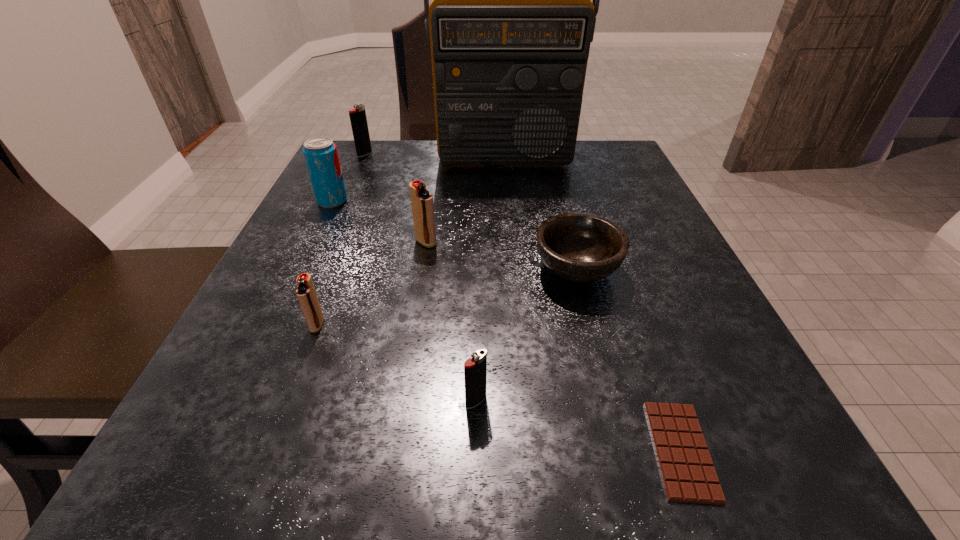
Identify the location of bowl. The height and width of the screenshot is (540, 960). click(580, 247).

Where is `brown bowl`? brown bowl is located at coordinates (580, 247).

Where is `the shortest object`? Image resolution: width=960 pixels, height=540 pixels. the shortest object is located at coordinates (688, 474).

I want to click on brown candy bar, so click(688, 474).

Find the location of `vacant area situated 0.050m on the front-facing side of the radio receiver`. vacant area situated 0.050m on the front-facing side of the radio receiver is located at coordinates (507, 183).

This screenshot has height=540, width=960. I want to click on vacant space located on the front of the third farthest object, so click(306, 255).

Where is `free space located on the right of the left black igniter`? The image size is (960, 540). free space located on the right of the left black igniter is located at coordinates (513, 154).

The width and height of the screenshot is (960, 540). I want to click on vacant space situated on the left of the bigger red igniter, so click(x=304, y=242).

Locate an element on the screen. This screenshot has height=540, width=960. vacant space located on the right of the second igniter from left to right is located at coordinates (378, 325).

Find the location of a particular element. The width and height of the screenshot is (960, 540). free spot located 0.070m on the front of the smaller black igniter is located at coordinates (475, 464).